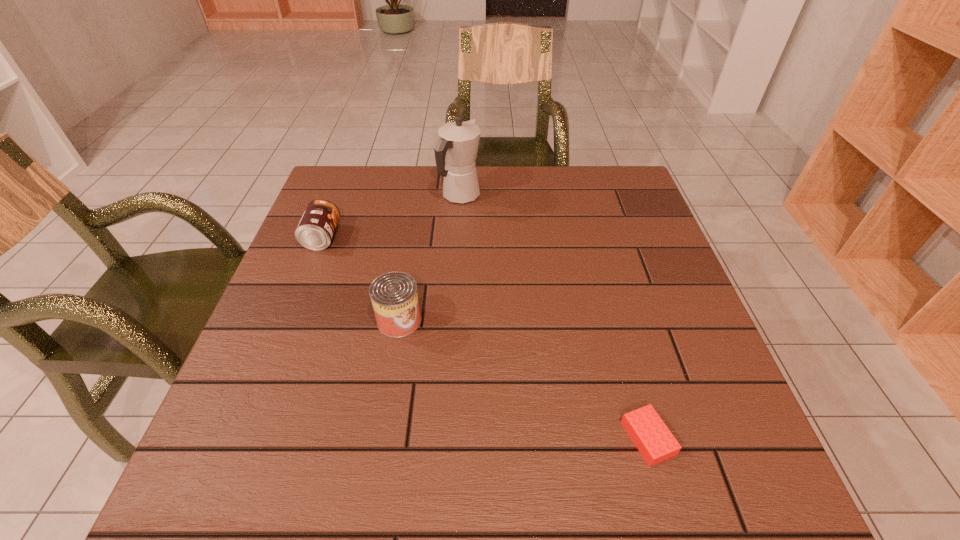
Where is `vacant area located 0.300m on the front label of the farther can`? The height and width of the screenshot is (540, 960). vacant area located 0.300m on the front label of the farther can is located at coordinates (457, 237).

Identify the location of vacant space located on the back of the rightmost object. The image size is (960, 540). (615, 320).

Locate an element on the screen. object positioned at the far edge is located at coordinates (457, 146).

Locate an element on the screen. The image size is (960, 540). object at the near edge is located at coordinates (655, 442).

You are a GUI agent. You are given a task and a screenshot of the screen. Output one action in this format:
    pyautogui.click(x=<x>, y=<y>)
    Task: Click on the object located in the left edge section of the desktop
    The width and height of the screenshot is (960, 540).
    Given the screenshot: What is the action you would take?
    pyautogui.click(x=315, y=230)

Where is `object at the right edge`? object at the right edge is located at coordinates (655, 442).

Where is `object situated at the near right corner`? This screenshot has height=540, width=960. object situated at the near right corner is located at coordinates [655, 442].

This screenshot has height=540, width=960. I want to click on free space at the far edge of the desktop, so click(x=579, y=188).

The height and width of the screenshot is (540, 960). Find the location of `vacant region at the near edge of the desktop`. vacant region at the near edge of the desktop is located at coordinates (308, 483).

Locate an element on the screen. Image resolution: width=960 pixels, height=540 pixels. free region at the left edge of the desktop is located at coordinates (244, 428).